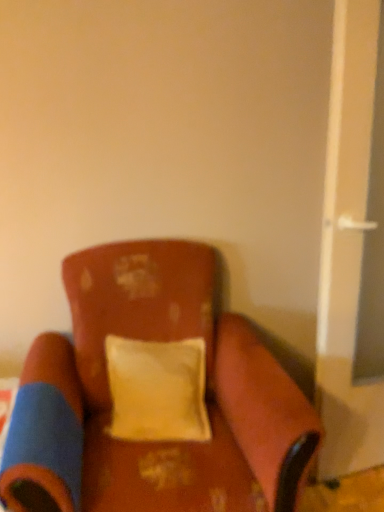
Identify the location of velvet-like brown chair at center. The image size is (384, 512). (154, 397).

Who is more distant, yellow fabric pillow at center or velvet-like brown chair at center?

Positioned behind is yellow fabric pillow at center.

Is yellow fabric pillow at center positioned with its back to velvet-like brown chair at center?

Correct, yellow fabric pillow at center is looking away from velvet-like brown chair at center.

From a real-world perspective, is yellow fabric pillow at center on top of velvet-like brown chair at center?

Yes, from a real-world perspective, yellow fabric pillow at center is above velvet-like brown chair at center.

How different are the orientations of yellow fabric pillow at center and velvet-like brown chair at center in degrees?

The angular difference between yellow fabric pillow at center and velvet-like brown chair at center is 9.75 degrees.

Is yellow fabric pillow at center to the right of white plastic screen door at right from the viewer's perspective?

In fact, yellow fabric pillow at center is to the left of white plastic screen door at right.

How many degrees apart are the facing directions of yellow fabric pillow at center and white plastic screen door at right?

They differ by 14 degrees in their facing directions.

Consider the image. Could you tell me if yellow fabric pillow at center is facing white plastic screen door at right?

No, yellow fabric pillow at center is not aimed at white plastic screen door at right.

Is yellow fabric pillow at center completely or partially outside of white plastic screen door at right?

Yes.

From a real-world perspective, between white plastic screen door at right and velvet-like brown chair at center, who is vertically lower?

velvet-like brown chair at center is physically lower.

Based on the photo, is velvet-like brown chair at center at the back of white plastic screen door at right?

white plastic screen door at right does not have its back to velvet-like brown chair at center.

Considering the sizes of white plastic screen door at right and velvet-like brown chair at center in the image, is white plastic screen door at right wider or thinner than velvet-like brown chair at center?

In the image, white plastic screen door at right appears to be more narrow than velvet-like brown chair at center.

From the image's perspective, which is below, white plastic screen door at right or velvet-like brown chair at center?

velvet-like brown chair at center.

Between velvet-like brown chair at center and white plastic screen door at right, which one has smaller width?

white plastic screen door at right is thinner.

Locate an element on the screen. This screenshot has height=512, width=384. screen door above the velvet-like brown chair at center (from the image's perspective) is located at coordinates (347, 248).

Is point (200, 437) behind point (337, 374)?

That is False.

From a real-world perspective, which is physically below, velvet-like brown chair at center or yellow fabric pillow at center?

In real-world perspective, velvet-like brown chair at center is lower.

Can you tell me how much velvet-like brown chair at center and yellow fabric pillow at center differ in facing direction?

velvet-like brown chair at center and yellow fabric pillow at center are facing 9.75 degrees away from each other.

Between velvet-like brown chair at center and yellow fabric pillow at center, which one has more height?

velvet-like brown chair at center is taller.

Identify the location of screen door above the yellow fabric pillow at center (from the image's perspective). The image size is (384, 512). (347, 248).

From a real-world perspective, is white plastic screen door at right physically above yellow fabric pillow at center?

Correct, in the physical world, white plastic screen door at right is higher than yellow fabric pillow at center.

Which object is further away from the camera, white plastic screen door at right or yellow fabric pillow at center?

yellow fabric pillow at center is further from the camera.

Is point (327, 296) closer or farther from the camera than point (169, 382)?

Point (327, 296).

Where is `chair on the right of yellow fabric pillow at center`? chair on the right of yellow fabric pillow at center is located at coordinates (154, 397).

Find the location of a particular element. This screenshot has width=384, height=512. pillow lying on the left of white plastic screen door at right is located at coordinates (157, 390).

Which object lies further to the anchor point white plastic screen door at right, velvet-like brown chair at center or yellow fabric pillow at center?

velvet-like brown chair at center.

When comparing their distances from yellow fabric pillow at center, does velvet-like brown chair at center or white plastic screen door at right seem closer?

velvet-like brown chair at center is closer to yellow fabric pillow at center.

When comparing their distances from velvet-like brown chair at center, does yellow fabric pillow at center or white plastic screen door at right seem closer?

yellow fabric pillow at center.

From the image, which object appears to be farther from yellow fabric pillow at center, white plastic screen door at right or velvet-like brown chair at center?

Based on the image, white plastic screen door at right appears to be further to yellow fabric pillow at center.

Considering their positions, is yellow fabric pillow at center positioned further to white plastic screen door at right than velvet-like brown chair at center?

Based on the image, velvet-like brown chair at center appears to be further to white plastic screen door at right.

Which object lies further to the anchor point velvet-like brown chair at center, white plastic screen door at right or yellow fabric pillow at center?

white plastic screen door at right is positioned further to the anchor velvet-like brown chair at center.

You are a GUI agent. You are given a task and a screenshot of the screen. Output one action in this format:
    pyautogui.click(x=<x>, y=<y>)
    Task: Click on the chair between yellow fabric pillow at center and white plastic screen door at right in the horizontal direction
    
    Given the screenshot: What is the action you would take?
    pyautogui.click(x=154, y=397)